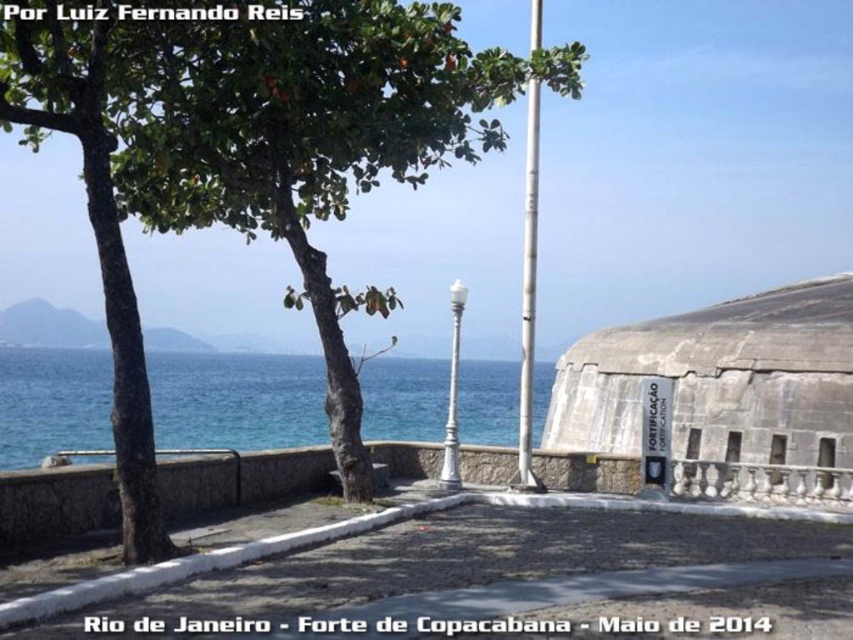
Question: Which of the following is the closest to the observer?

Choices:
 (A) (838, 428)
 (B) (107, 44)
 (C) (47, 355)

Answer: (B)

Question: Can you confirm if green leafy tree at left is thinner than gray concrete bunker at right?

Choices:
 (A) no
 (B) yes

Answer: (A)

Question: Which point is farther to the camera?

Choices:
 (A) green leafy tree at left
 (B) gray concrete bunker at right

Answer: (B)

Question: Which of the following is the closest to the observer?

Choices:
 (A) green leafy tree at left
 (B) gray concrete bunker at right
 (C) blue water at center

Answer: (A)

Question: Can you confirm if gray concrete bunker at right is positioned to the right of blue water at center?

Choices:
 (A) no
 (B) yes

Answer: (B)

Question: Can you confirm if green leafy tree at left is bigger than gray concrete bunker at right?

Choices:
 (A) no
 (B) yes

Answer: (B)